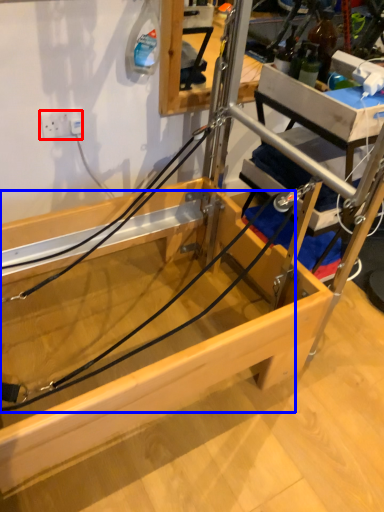
Question: Among these objects, which one is farthest to the camera, electric outlet (highlighted by a red box) or string (highlighted by a blue box)?

Choices:
 (A) electric outlet
 (B) string

Answer: (A)